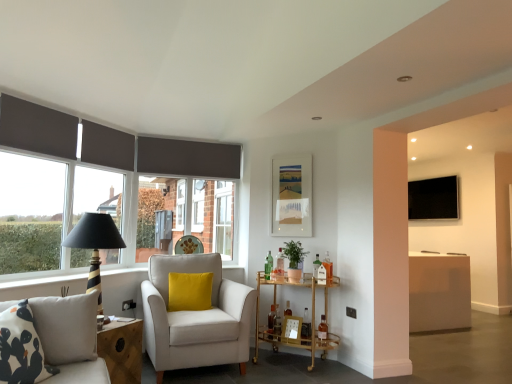
What do you see at coordinates (95, 244) in the screenshot? I see `black striped table lamp at left` at bounding box center [95, 244].

What do you see at coordinates (285, 325) in the screenshot? I see `gold metallic bar cart at center` at bounding box center [285, 325].

You are a GUI agent. You are given a task and a screenshot of the screen. Output one action in this format:
    pyautogui.click(x=<x>, y=<y>)
    Task: Click on the velvet yellow pillow at center
    This screenshot has height=384, width=512.
    Given the screenshot: What is the action you would take?
    pyautogui.click(x=189, y=291)

Describe the element at coordinates (70, 336) in the screenshot. This screenshot has width=512, height=384. I see `patterned fabric studio couch at lower left` at that location.

Image resolution: width=512 pixels, height=384 pixels. What do you see at coordinates (291, 330) in the screenshot?
I see `wooden picture frame at lower center, marked as the second picture frame in a back-to-front arrangement` at bounding box center [291, 330].

Find the location of a particular element. green glass bottle at center is located at coordinates (268, 266).

Identify the location of black matte tv at upper right. (433, 198).

This screenshot has height=384, width=512. I want to click on table lamp above the green glass bottle at center (from a real-world perspective), so click(95, 244).

Is point (73, 231) farther from viewer compared to point (267, 269)?

No.

Measure the distance between black striped table lamp at left and green glass bottle at center.

black striped table lamp at left and green glass bottle at center are 5.33 feet apart.

From the picture: Which is farther from the camera, [294,338] or [0,311]?

The point [294,338] is farther from the camera.

From a real-world perspective, is wooden picture frame at lower center, the 2th picture frame viewed from the top, positioned under patterned fabric studio couch at lower left based on gravity?

Indeed, from a real-world perspective, wooden picture frame at lower center, the 2th picture frame viewed from the top, is positioned beneath patterned fabric studio couch at lower left.

Considering the sizes of wooden picture frame at lower center, marked as the second picture frame in a back-to-front arrangement, and patterned fabric studio couch at lower left in the image, is wooden picture frame at lower center, marked as the second picture frame in a back-to-front arrangement, taller or shorter than patterned fabric studio couch at lower left?

Clearly, wooden picture frame at lower center, marked as the second picture frame in a back-to-front arrangement, is shorter compared to patterned fabric studio couch at lower left.

Between wooden picture frame at lower center, which is the first picture frame in front-to-back order, and patterned fabric studio couch at lower left, which one has smaller size?

With smaller size is wooden picture frame at lower center, which is the first picture frame in front-to-back order.

Which is farther, (85, 368) or (93, 217)?

Positioned behind is point (93, 217).

How many degrees apart are the facing directions of patterned fabric studio couch at lower left and black striped table lamp at left?

The angle between the facing direction of patterned fabric studio couch at lower left and the facing direction of black striped table lamp at left is 7.29 degrees.

Is black striped table lamp at left at the back of patterned fabric studio couch at lower left?

That's not correct — patterned fabric studio couch at lower left is not looking away from black striped table lamp at left.

From the picture: Would you consider patterned fabric studio couch at lower left to be distant from black striped table lamp at left?

No, there isn't a large distance between patterned fabric studio couch at lower left and black striped table lamp at left.

Considering the relative sizes of velvet yellow pillow at center and green glass bottle at center in the image provided, is velvet yellow pillow at center shorter than green glass bottle at center?

No.

Can you confirm if velvet yellow pillow at center is positioned to the left of green glass bottle at center?

Correct, you'll find velvet yellow pillow at center to the left of green glass bottle at center.

Is velvet yellow pillow at center closer to the viewer compared to green glass bottle at center?

Yes.

Is green glass bottle at center located within velvet yellow pillow at center?

Definitely not — green glass bottle at center is not inside velvet yellow pillow at center.

Considering the relative sizes of black striped table lamp at left and matte black lampshade at left in the image provided, is black striped table lamp at left wider than matte black lampshade at left?

Yes, black striped table lamp at left is wider than matte black lampshade at left.

Which is in front, black striped table lamp at left or matte black lampshade at left?

black striped table lamp at left is closer to the camera.

Is point (87, 236) closer to camera compared to point (99, 192)?

Yes, it is in front of point (99, 192).

From the image's perspective, who appears lower, black striped table lamp at left or matte black lampshade at left?

black striped table lamp at left, from the image's perspective.

Is point (64, 316) positioned after point (439, 207)?

No.

From the picture: From the image's perspective, between patterned fabric studio couch at lower left and black matte tv at upper right, which one is located above?

black matte tv at upper right, from the image's perspective.

Visually, is patterned fabric studio couch at lower left positioned to the left or to the right of black matte tv at upper right?

From the image, it's evident that patterned fabric studio couch at lower left is to the left of black matte tv at upper right.

The width and height of the screenshot is (512, 384). Find the location of `studio couch in front of the black matte tv at upper right`. studio couch in front of the black matte tv at upper right is located at coordinates (70, 336).

From the image's perspective, is velvet yellow pillow at center below matte white picture frame at upper center, arranged as the second picture frame when viewed from the front?

Yes, from the image's perspective, velvet yellow pillow at center is beneath matte white picture frame at upper center, arranged as the second picture frame when viewed from the front.

Is velvet yellow pillow at center positioned with its back to matte white picture frame at upper center, which ranks as the 2th picture frame in bottom-to-top order?

No, velvet yellow pillow at center is not facing away from matte white picture frame at upper center, which ranks as the 2th picture frame in bottom-to-top order.

From their relative heights in the image, would you say velvet yellow pillow at center is taller or shorter than matte white picture frame at upper center, the 1th picture frame when ordered from back to front?

Considering their sizes, velvet yellow pillow at center has less height than matte white picture frame at upper center, the 1th picture frame when ordered from back to front.

You are a GUI agent. You are given a task and a screenshot of the screen. Output one action in this format:
    pyautogui.click(x=<x>, y=<y>)
    Task: Click on the table lamp in front of the green glass bottle at center
    
    Given the screenshot: What is the action you would take?
    pos(95,244)

Identify the location of picture frame below the patterned fabric studio couch at lower left (from the image's perspective). The image size is (512, 384). (291, 330).

From the image, which object appears to be nearer to black matte tv at upper right, patterned fabric studio couch at lower left or green glass bottle at center?

The object closer to black matte tv at upper right is green glass bottle at center.

Looking at the image, which one is located closer to wooden picture frame at lower center, which is the first picture frame in front-to-back order, patterned fabric studio couch at lower left or black striped table lamp at left?

black striped table lamp at left is positioned closer to the anchor wooden picture frame at lower center, which is the first picture frame in front-to-back order.

Considering their positions, is matte white picture frame at upper center, the 1th picture frame from the top, positioned closer to black striped table lamp at left than wooden picture frame at lower center, the 2th picture frame viewed from the top?

wooden picture frame at lower center, the 2th picture frame viewed from the top.

Looking at the image, which one is located further to wooden picture frame at lower center, the 1th picture frame positioned from the bottom, velvet yellow pillow at center or black matte tv at upper right?

Based on the image, black matte tv at upper right appears to be further to wooden picture frame at lower center, the 1th picture frame positioned from the bottom.

Estimate the real-world distances between objects in this image. Which object is further from black matte tv at upper right, black striped table lamp at left or gold metallic bar cart at center?

black striped table lamp at left is further to black matte tv at upper right.

Looking at the image, which one is located closer to matte white picture frame at upper center, arranged as the second picture frame when viewed from the front, matte black lampshade at left or wooden picture frame at lower center, the 1th picture frame positioned from the bottom?

Among the two, wooden picture frame at lower center, the 1th picture frame positioned from the bottom, is located nearer to matte white picture frame at upper center, arranged as the second picture frame when viewed from the front.

Looking at this image, estimate the real-world distances between objects in this image. Which object is further from wooden picture frame at lower center, marked as the second picture frame in a back-to-front arrangement, patterned fabric studio couch at lower left or black matte tv at upper right?

black matte tv at upper right lies further to wooden picture frame at lower center, marked as the second picture frame in a back-to-front arrangement, than the other object.

Which object lies further to the anchor point green glass bottle at center, matte white picture frame at upper center, the 1th picture frame when ordered from back to front, or black matte tv at upper right?

Among the two, black matte tv at upper right is located further to green glass bottle at center.

At what (x,y) coordinates should I click in order to perform the action: click on window between patterned fabric studio couch at lower left and black matte tv at upper right from front to back. Please return your answer as a coordinate pair (x, y). Looking at the image, I should click on (97, 193).

Identify the location of chair between matte black lampshade at left and wooden picture frame at lower center, marked as the second picture frame in a back-to-front arrangement, from left to right. (195, 317).

Locate an element on the screen. Image resolution: width=512 pixels, height=384 pixels. bottle positioned between patterned fabric studio couch at lower left and matte white picture frame at upper center, arranged as the second picture frame when viewed from the front, from near to far is located at coordinates (268, 266).

I want to click on pillow between white fabric armchair with yellow cushion at center and green glass bottle at center along the z-axis, so click(x=189, y=291).